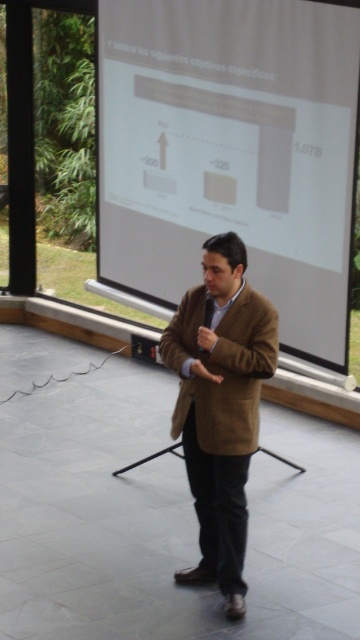
Which is in front, point (216, 481) or point (187, 404)?

Point (216, 481) is more forward.

Is brown woolen coat at center behind brown woolen jacket at center?

No, it is in front of brown woolen jacket at center.

Who is more distant from viewer, (209,262) or (228,435)?

The point (228,435) is behind.

Where is `brown woolen coat at center`? This screenshot has width=360, height=640. brown woolen coat at center is located at coordinates (219, 404).

Who is positioned more to the right, white matte projection screen at center or brown woolen jacket at center?

brown woolen jacket at center is more to the right.

Is point (257, 193) less distant than point (271, 364)?

No, it is behind (271, 364).

This screenshot has width=360, height=640. I want to click on white matte projection screen at center, so click(x=231, y=150).

Between white matte projection screen at center and brown woolen coat at center, which one appears on the left side from the viewer's perspective?

brown woolen coat at center

Does white matte projection screen at center have a greater height compared to brown woolen coat at center?

Indeed, white matte projection screen at center has a greater height compared to brown woolen coat at center.

Between point (248, 202) and point (187, 451), which one is positioned in front?

Point (187, 451) is in front.

Locate an element on the screen. white matte projection screen at center is located at coordinates (231, 150).